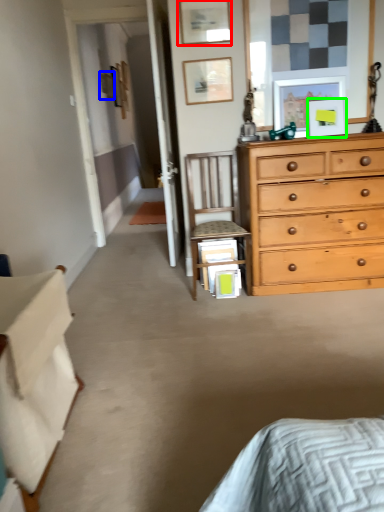
Question: Estimate the real-world distances between objects in this image. Which object is farther from picture frame (highlighted by a red box), picture frame (highlighted by a blue box) or picture frame (highlighted by a green box)?

Choices:
 (A) picture frame
 (B) picture frame

Answer: (A)